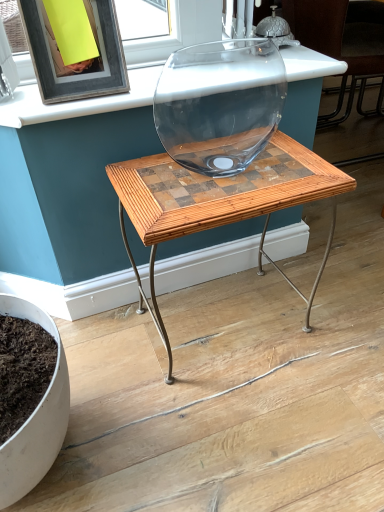
Question: Is matte black frame at upper left inside the boundaries of transparent glass vase at center, or outside?

Choices:
 (A) inside
 (B) outside

Answer: (B)

Question: Is matte black frame at upper left in front of or behind transparent glass vase at center in the image?

Choices:
 (A) front
 (B) behind

Answer: (A)

Question: Estimate the real-world distances between objects in this image. Which object is farther from the matte black frame at upper left?

Choices:
 (A) wooden mosaic table at center
 (B) transparent glass bowl at upper center
 (C) transparent glass vase at center

Answer: (C)

Question: Which of these objects is positioned farthest from the transparent glass vase at center?

Choices:
 (A) transparent glass bowl at upper center
 (B) matte black frame at upper left
 (C) wooden mosaic table at center

Answer: (B)